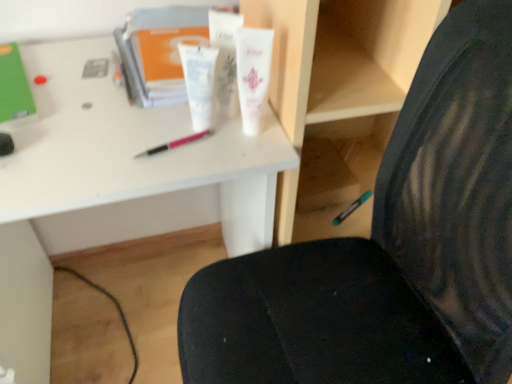
Where is `free location to the left of white glossy lotion at center, the 2th toiletry from the right`? free location to the left of white glossy lotion at center, the 2th toiletry from the right is located at coordinates (123, 117).